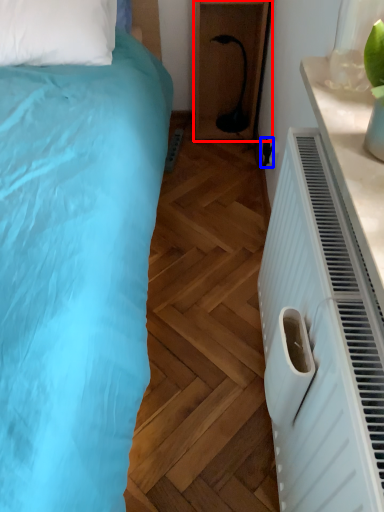
Question: Among these objects, which one is nearest to the camera, furniture (highlighted by a red box) or electric outlet (highlighted by a blue box)?

Choices:
 (A) furniture
 (B) electric outlet

Answer: (B)